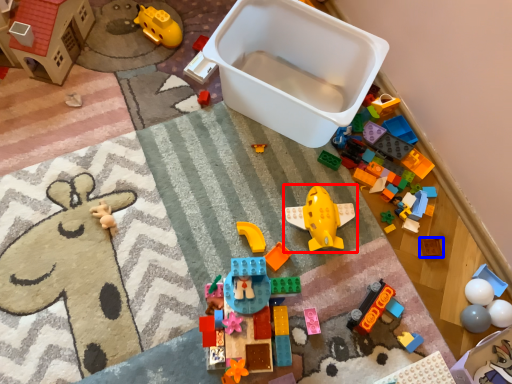
Question: Which object is further to the camera taking this photo, toy (highlighted by a red box) or toy (highlighted by a blue box)?

Choices:
 (A) toy
 (B) toy

Answer: (B)